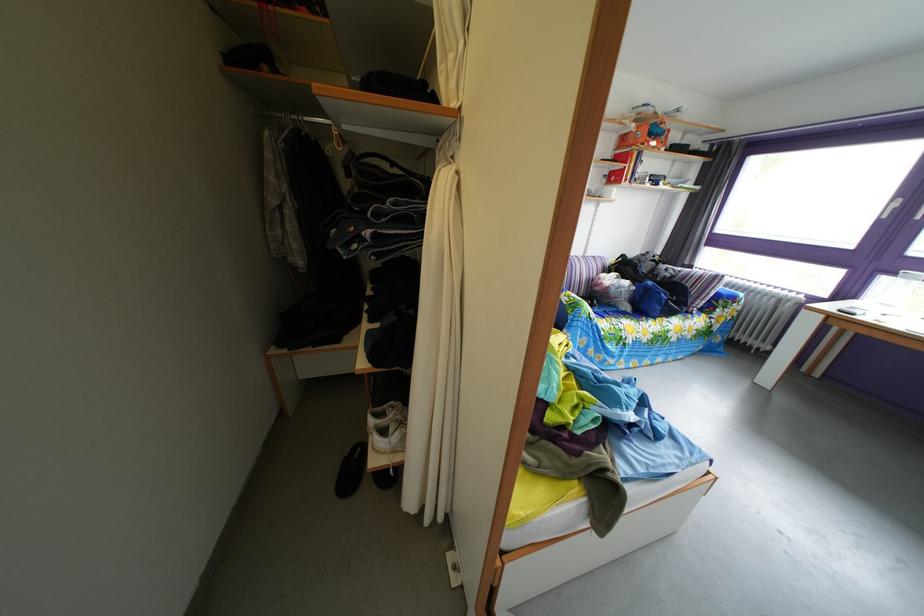
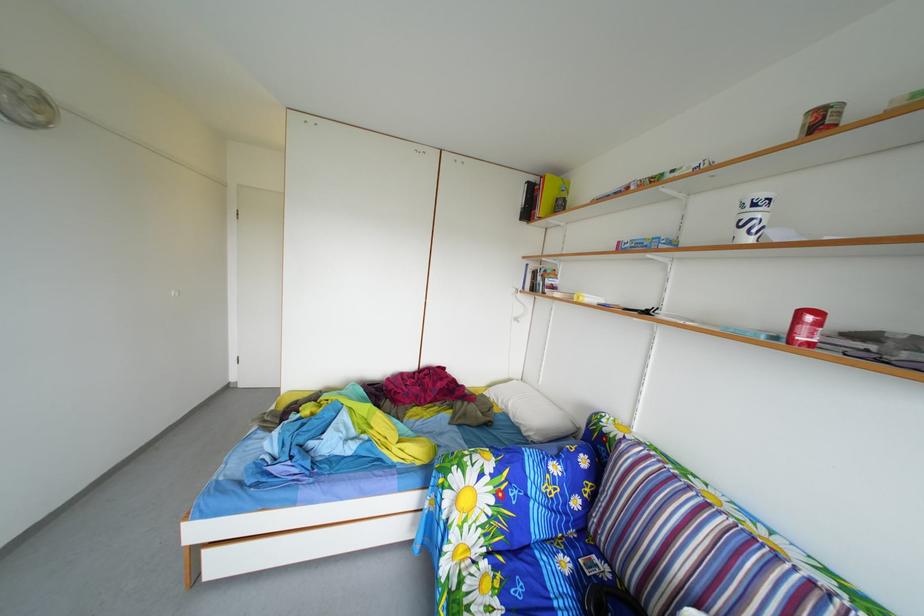
Locate, in the second image, the point that corresponds to [602,328] in the first image.

(453, 507)